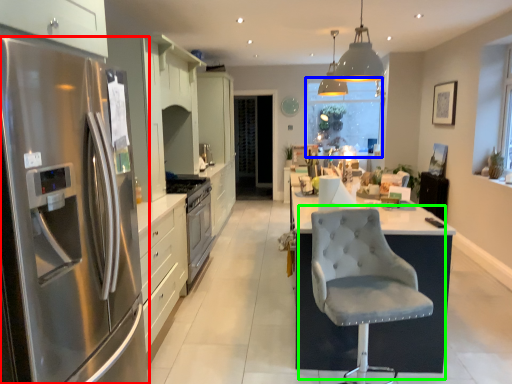
Question: Based on their relative distances, which object is nearer to refrigerator (highlighted by a red box)? Choose from window screen (highlighted by a blue box) and chair (highlighted by a green box).

Choices:
 (A) window screen
 (B) chair

Answer: (B)